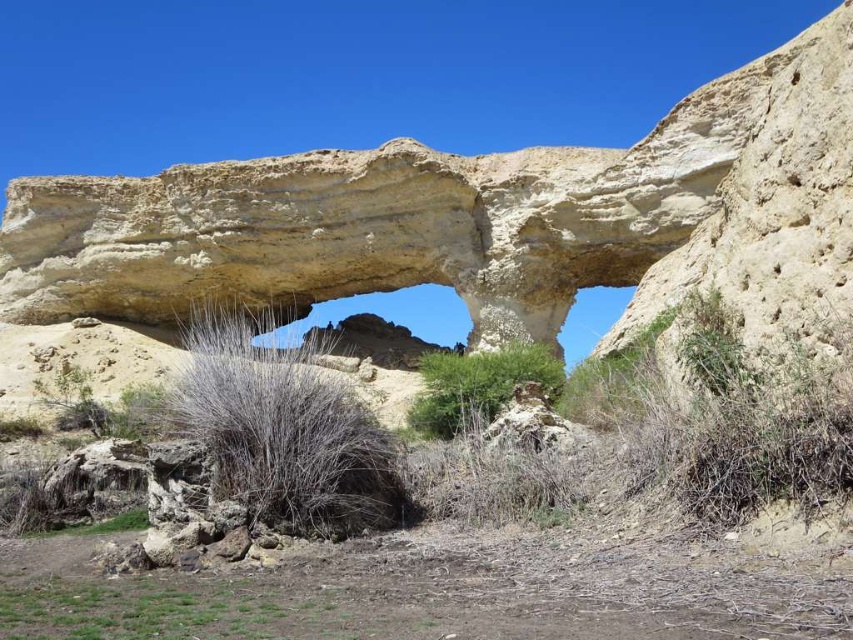
You are standing in front of the rock formation and want to take a photo of the matte sandstone rock arch at center and the green leafy bush at center. Which object should you focus on first if you want both to be in sharp focus?

The matte sandstone rock arch at center is closer to the viewer than the green leafy bush at center. To have both in sharp focus, focus on the matte sandstone rock arch at center since it is closer, ensuring the depth of field includes the farther bush.

You are a hiker trying to cross through the archway. You notice dry grass at center and green leafy bush at center in your path. Which one is wider so you can choose the better path?

The dry grass at center is wider than the green leafy bush at center, so you should choose the path through the dry grass at center for easier passage.